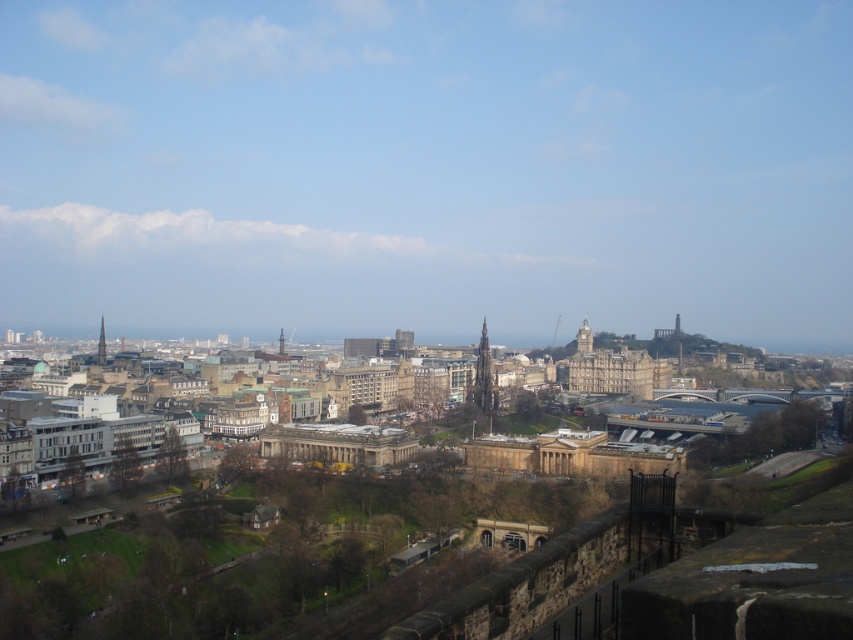
You are standing at the viewpoint overlooking Edinburgh and see the smooth stone clock tower at center and the smooth stone tower at center. Which of these two towers is located to the right side of the other?

The smooth stone clock tower at center is positioned on the right side of the smooth stone tower at center.

You are standing at the viewpoint of the image, and you want to reach the smooth gray stone tower at center. If your walking speed is 3 feet per second, how many seconds will it take you to reach the tower?

The distance between you and the smooth gray stone tower at center is 1281.61 feet. At a walking speed of 3 feet per second, it would take approximately 427.2 seconds to reach the tower.

You are standing at the viewpoint overlooking Edinburgh and see the smooth gray stone tower at center and the smooth stone tower at center. Which one is closer to you?

Both the smooth gray stone tower at center and the smooth stone tower at center are the same structure, so they are at the same distance from you.